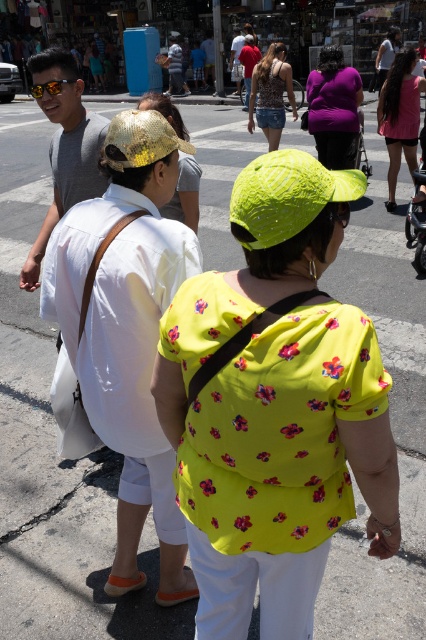
You are a photographer trying to capture a photo of the matte yellow cap at center and the pink fabric dress at upper right. Which object should you focus on first to ensure it appears larger in your photo?

The matte yellow cap at center is closer to the viewer than the pink fabric dress at upper right, so focusing on it first will make it appear larger in the photo.

You are standing on the street and want to hand a leaflet to the person wearing the shiny gold hat at center and the person wearing the patterned fabric dress at center. If you can throw a leaflet 7 meters, can you reach both of them with one throw?

The shiny gold hat at center is 6.90 meters from the patterned fabric dress at center. Since the distance between them is less than 7 meters, you can throw the leaflet to one of them and it will land within 7 meters of both, so yes, you can reach both with one throw.

You are a photographer standing on the sidewalk and want to take a photo of the matte yellow cap at center and the patterned fabric dress at center in the same frame. Given that your camera has a maximum focus range of 30 feet, will both objects be in focus?

The matte yellow cap at center and patterned fabric dress at center are 29.55 feet apart. Since the distance between them is within the camera maximum focus range of 30 feet, both objects will be in focus.